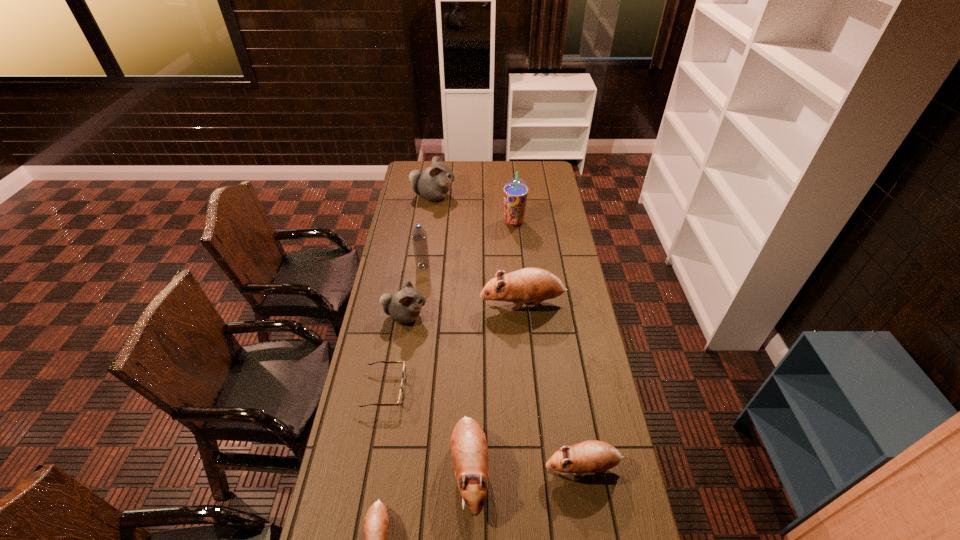
Locate an element on the screen. This screenshot has width=960, height=540. smoothie is located at coordinates (515, 191).

Find the location of a particular element. The height and width of the screenshot is (540, 960). the second farthest object is located at coordinates (515, 191).

Where is `blue water bottle`? blue water bottle is located at coordinates (419, 237).

You are a GUI agent. You are given a task and a screenshot of the screen. Output one action in this format:
    pyautogui.click(x=<x>, y=<y>)
    Task: Click on the water bottle
    The height and width of the screenshot is (540, 960).
    Given the screenshot: What is the action you would take?
    pyautogui.click(x=419, y=237)

I want to click on the farthest hamster, so click(433, 183).

I want to click on the bigger white hamster, so click(433, 183).

Find the location of `the farthest brown hamster`. the farthest brown hamster is located at coordinates tap(528, 284).

The image size is (960, 540). What are the coordinates of `the smaller white hamster` in the screenshot? It's located at (404, 306).

The width and height of the screenshot is (960, 540). In order to click on the third smallest brown hamster in this screenshot , I will do `click(469, 452)`.

At what (x,y) coordinates should I click in order to perform the action: click on the third biggest brown hamster. Please return your answer as a coordinate pair (x, y). Looking at the image, I should click on (591, 456).